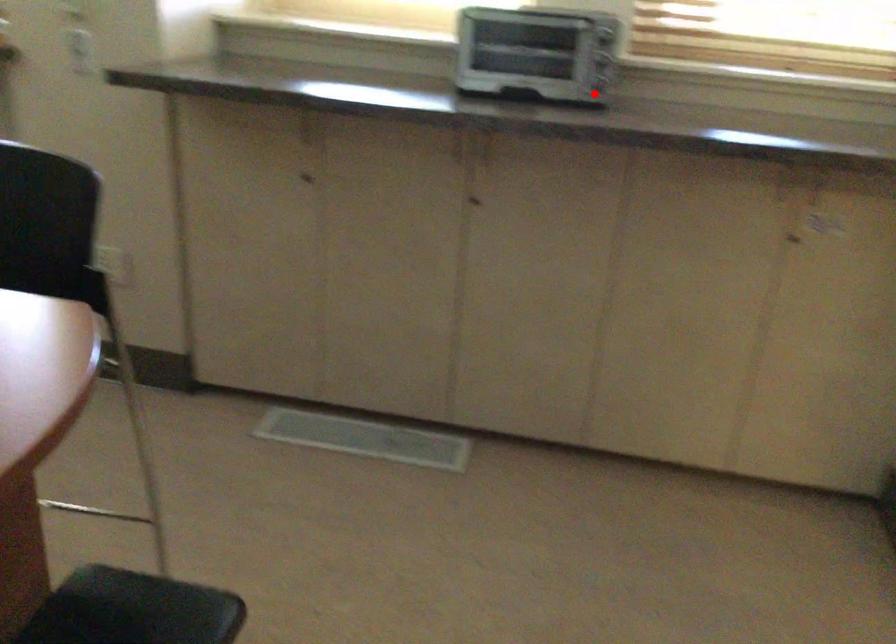
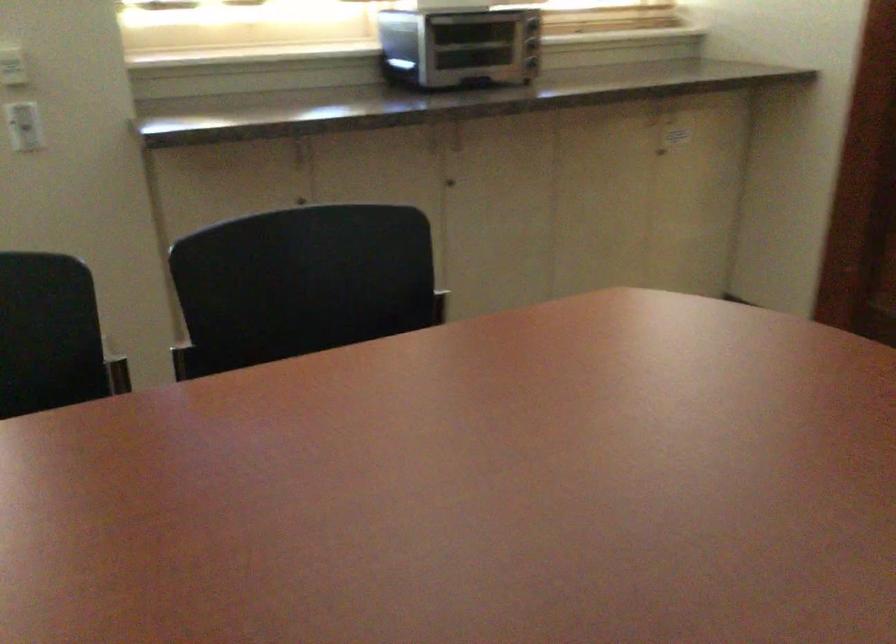
Question: A red point is marked in image1. In image2, is the corresponding 3D point closer to the camera or farther? Reply with the corresponding letter.

Choices:
 (A) The corresponding 3D point is closer.
 (B) The corresponding 3D point is farther.

Answer: (B)